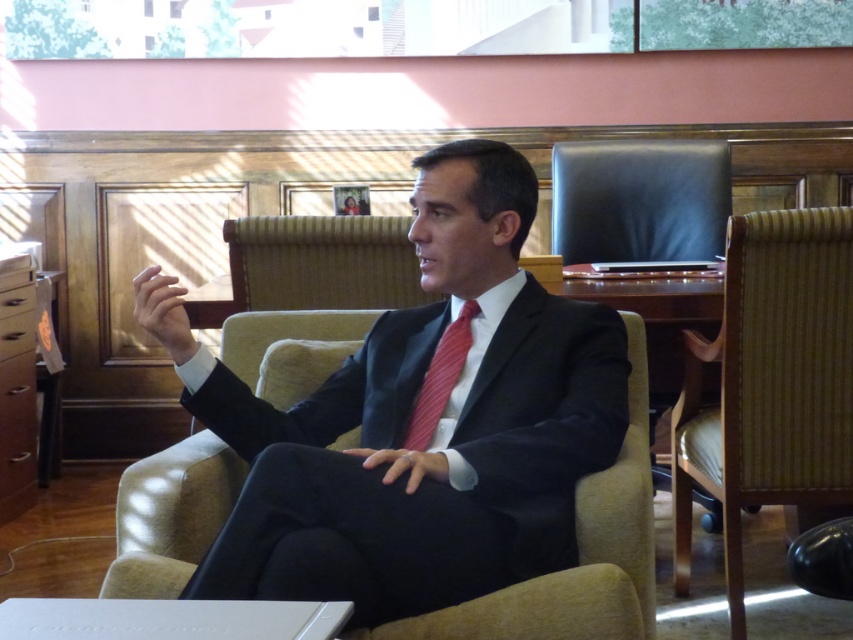
You are a fashion designer observing a man in a dark blue suit at center and a red striped tie at center. Which clothing item is positioned to the left side of the other?

The dark blue suit at center is to the left of the red striped tie at center.

You are an interior designer assessing the space for a new desk. You notice the dark blue suit at center and the woven fabric swivel chair at right. Which object is wider, potentially affecting desk placement?

The dark blue suit at center might be wider than woven fabric swivel chair at right, so it could require more space when placing the desk.

You are standing in the office and want to determine which of the two points, point [456,516] or point [428,376], is closer to you. Based on the scene description, which point is nearer?

Point [456,516] is closer to the camera than point [428,376], so it is the nearer one.